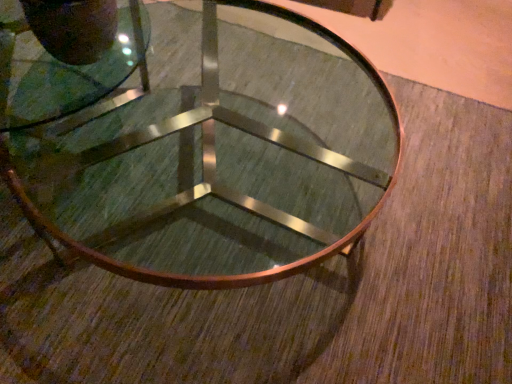
Question: Should I look upward or downward to see transparent glass coffee table at center?

Choices:
 (A) down
 (B) up

Answer: (B)